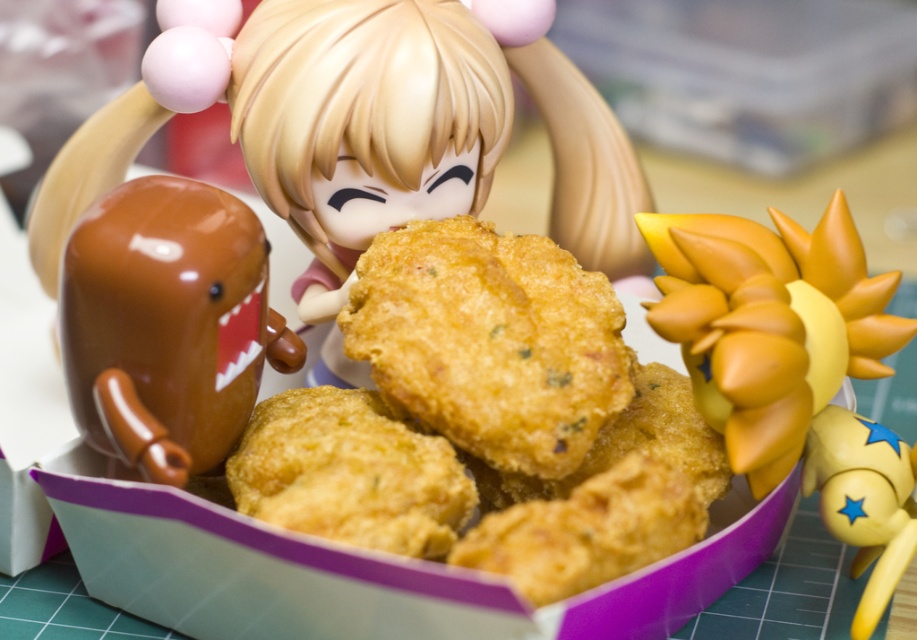
Question: Does glossy chocolate toy at left have a smaller size compared to yellow spiky hair at right?

Choices:
 (A) no
 (B) yes

Answer: (B)

Question: Based on their relative distances, which object is farther from the yellow rubber toy at lower right?

Choices:
 (A) golden crispy nugget at center
 (B) golden crispy nuggets at center
 (C) yellow spiky hair at right
 (D) glossy chocolate toy at left

Answer: (D)

Question: Estimate the real-world distances between objects in this image. Which object is farther from the golden crispy nugget at center?

Choices:
 (A) golden crispy nuggets at center
 (B) yellow rubber toy at lower right
 (C) glossy chocolate toy at left
 (D) yellow spiky hair at right

Answer: (B)

Question: Does golden crispy nuggets at center appear over yellow rubber toy at lower right?

Choices:
 (A) yes
 (B) no

Answer: (A)

Question: Can you confirm if yellow spiky hair at right is positioned below yellow rubber toy at lower right?

Choices:
 (A) yes
 (B) no

Answer: (B)

Question: Which object is positioned closest to the glossy chocolate toy at left?

Choices:
 (A) golden crispy nuggets at center
 (B) golden crispy nugget at center
 (C) yellow spiky hair at right

Answer: (A)